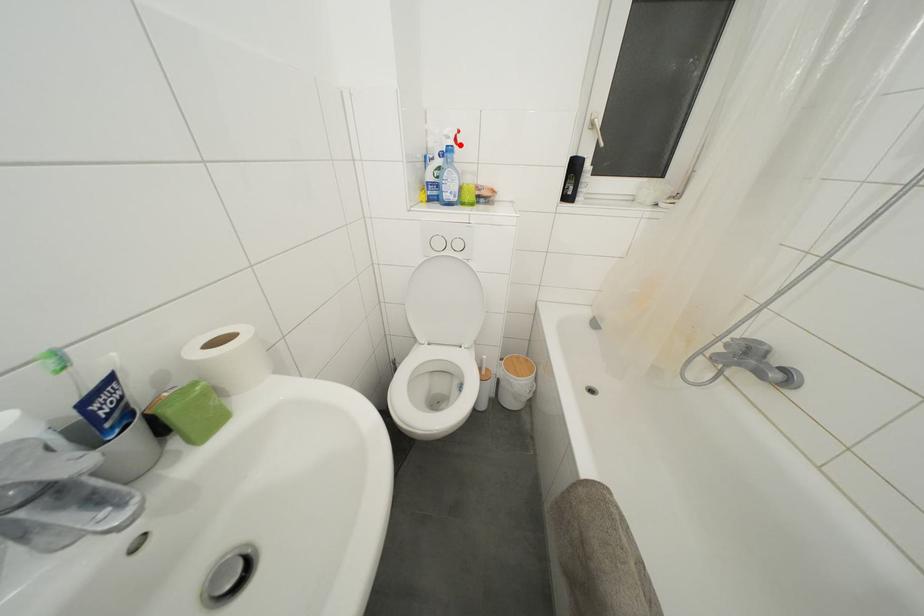
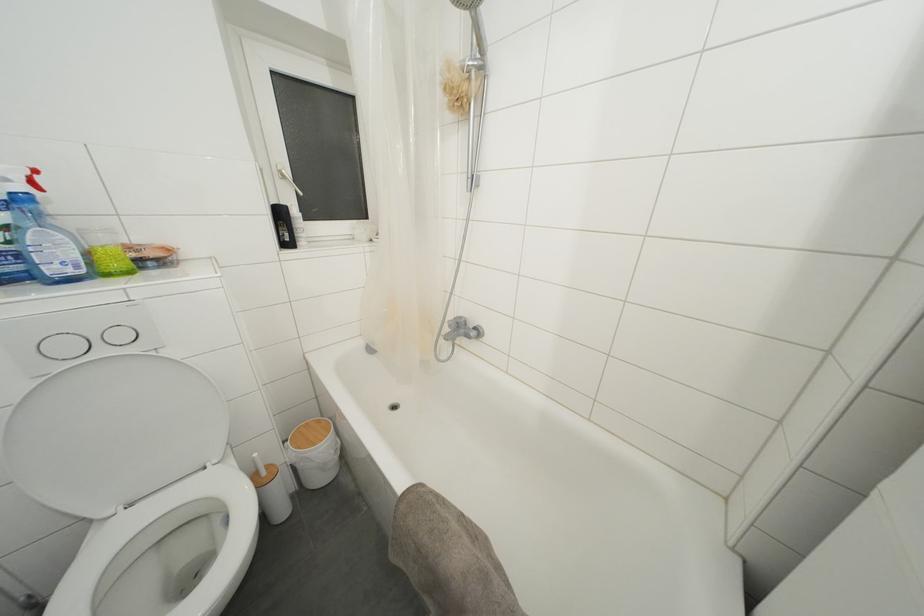
In the second image, find the point that corresponds to the highlighted location in the first image.

(37, 188)